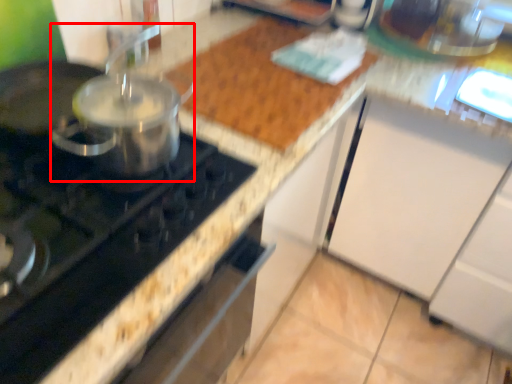
Question: From the image's perspective, what is the correct spatial positioning of kitchen appliance (annotated by the red box) in reference to gas stove?

Choices:
 (A) below
 (B) above

Answer: (B)